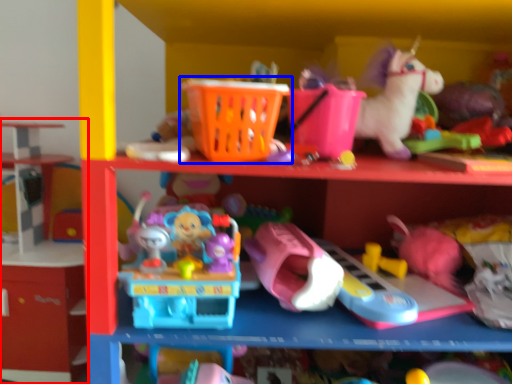
Question: Among these objects, which one is farthest to the camera, shelf (highlighted by a red box) or toy (highlighted by a blue box)?

Choices:
 (A) shelf
 (B) toy

Answer: (A)